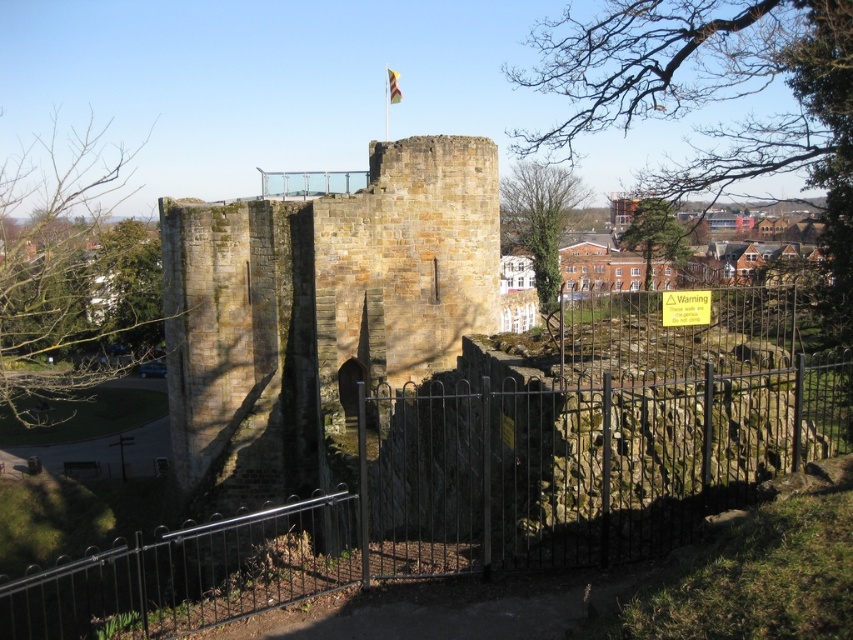
Question: Based on their relative distances, which object is nearer to the brown stone ruins at center?

Choices:
 (A) yellow fabric flag at center
 (B) black wrought iron gate at center

Answer: (B)

Question: Can you confirm if black wrought iron gate at center is positioned below brown stone ruins at center?

Choices:
 (A) no
 (B) yes

Answer: (B)

Question: Does black wrought iron gate at center have a lesser width compared to yellow fabric flag at center?

Choices:
 (A) yes
 (B) no

Answer: (B)

Question: In this image, where is brown stone ruins at center located relative to yellow fabric flag at center?

Choices:
 (A) left
 (B) right

Answer: (A)

Question: Which object is farther from the camera taking this photo?

Choices:
 (A) yellow fabric flag at center
 (B) black wrought iron gate at center
 (C) brown stone ruins at center

Answer: (A)

Question: Which object is positioned farthest from the yellow fabric flag at center?

Choices:
 (A) black wrought iron gate at center
 (B) brown stone ruins at center

Answer: (A)